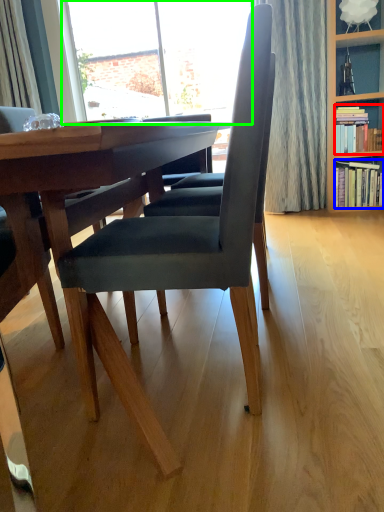
Question: Which is nearer to the book (highlighted by a red box)? book (highlighted by a blue box) or window (highlighted by a green box).

Choices:
 (A) book
 (B) window

Answer: (A)